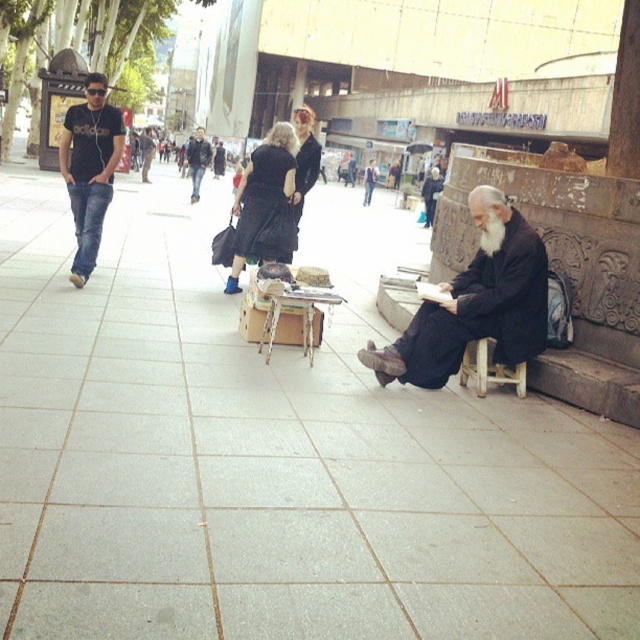
You are a pedestrian standing at the edge of the walkway and see the black matte robe at lower right and the black matte dress at center. Which one is more to the right side?

The black matte robe at lower right is more to the right side.